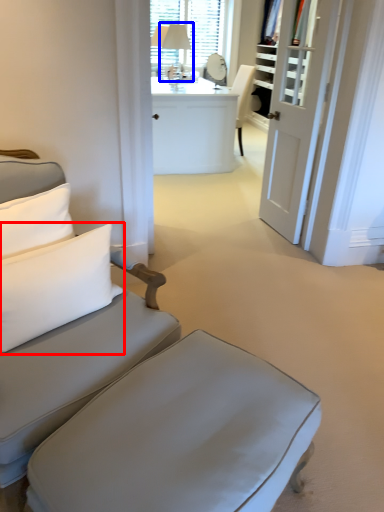
Question: Which object is closer to the camera taking this photo, pillow (highlighted by a red box) or table lamp (highlighted by a blue box)?

Choices:
 (A) pillow
 (B) table lamp

Answer: (A)